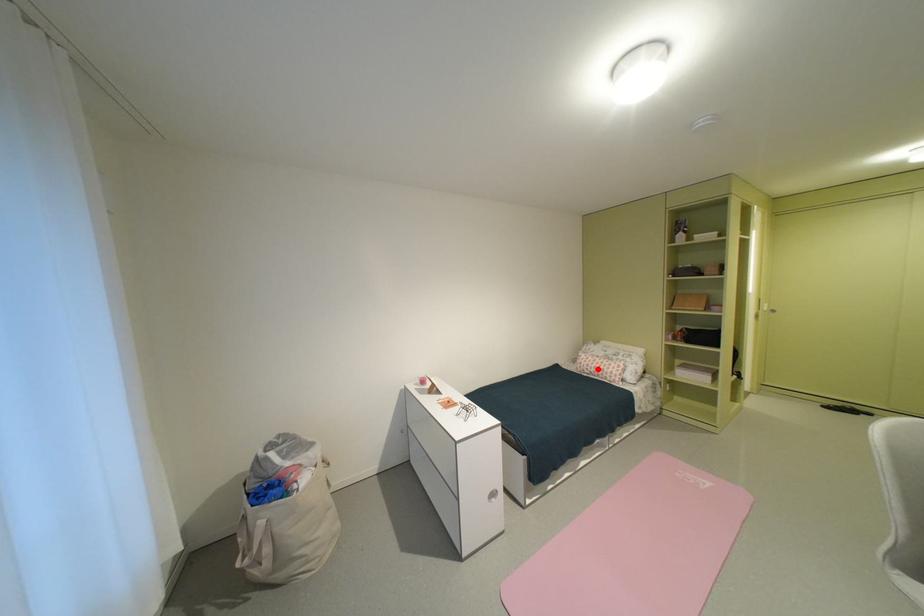
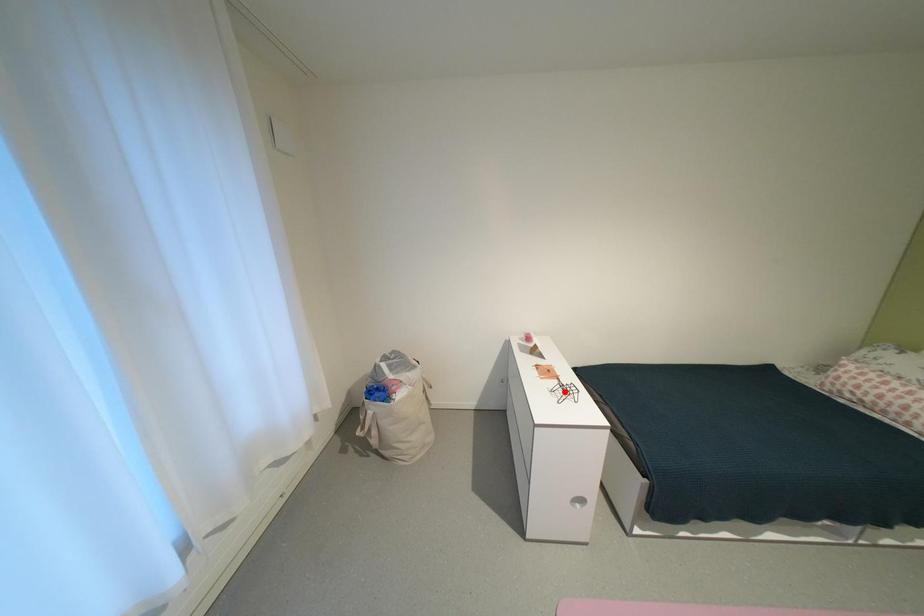
I am providing you with two images of the same scene from different viewpoints. A red point is marked on the first image and another point is marked on the second image. Is the marked point in image1 the same physical position as the marked point in image2?

No